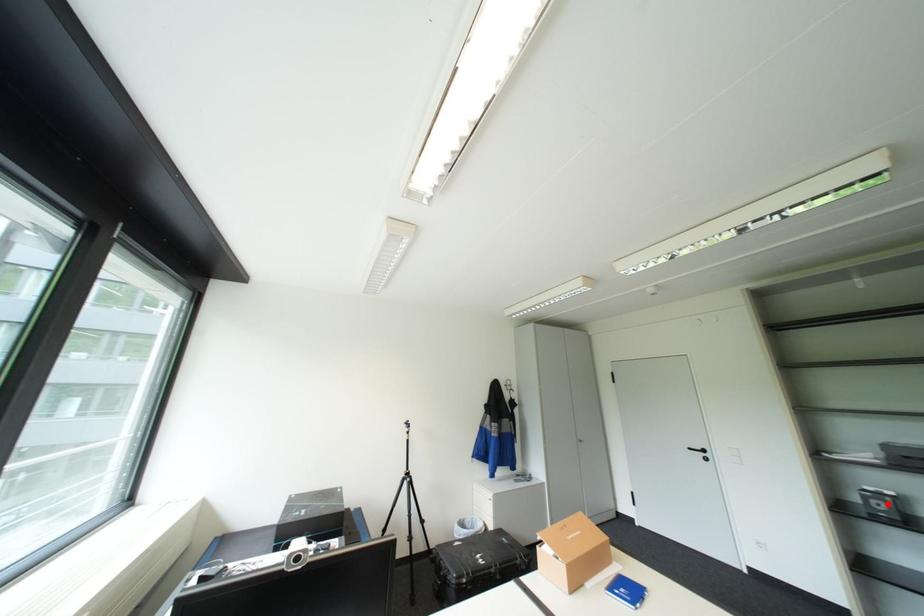
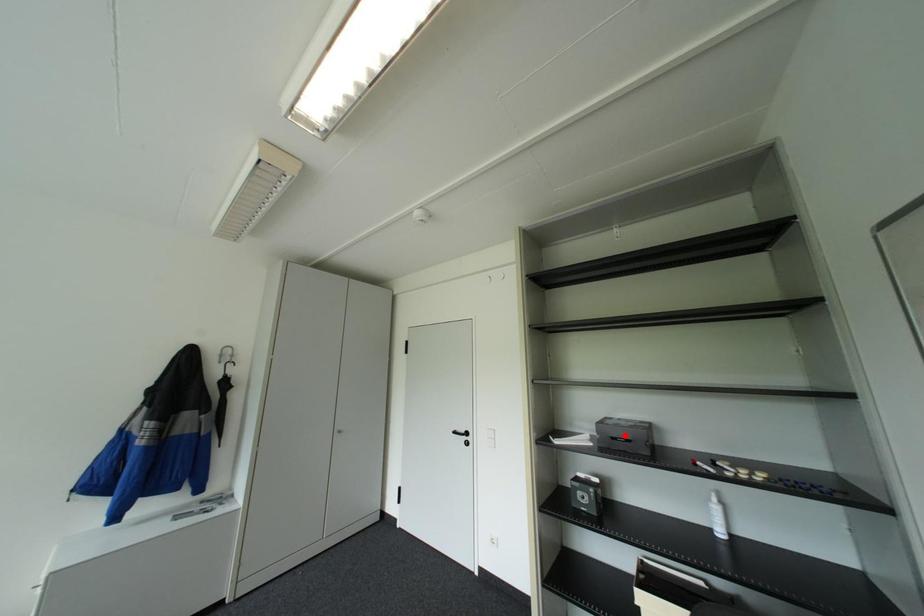
I am providing you with two images of the same scene from different viewpoints. A red point is marked on the first image and another point is marked on the second image. Are the points marked in image1 and image2 representing the same 3D position?

No